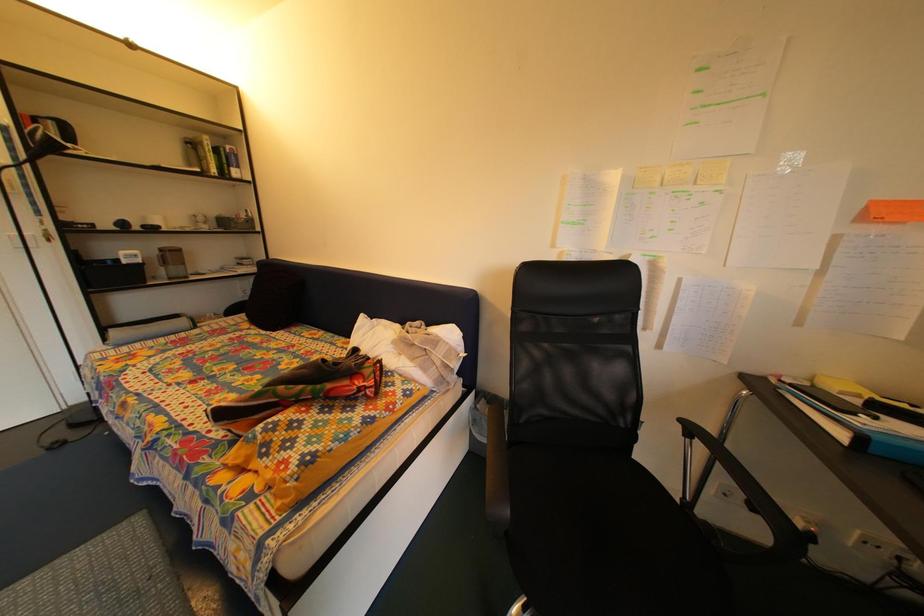
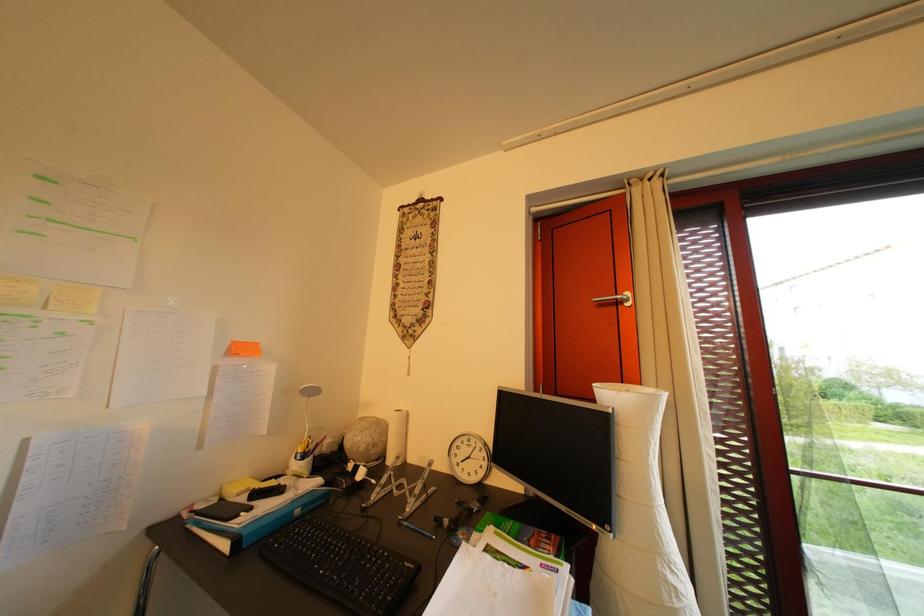
Question: The camera is either moving clockwise (left) or counter-clockwise (right) around the object. The first image is from the beginning of the video and the second image is from the end. Is the camera moving left or right when shooting the video?

Choices:
 (A) Left
 (B) Right

Answer: (A)